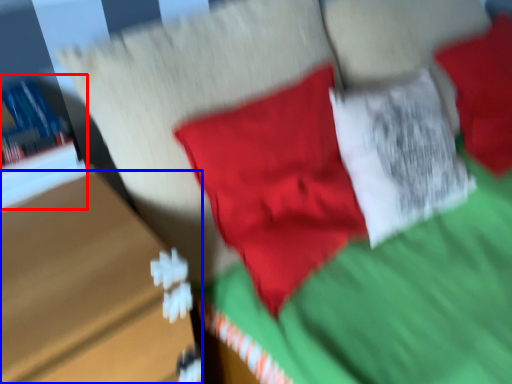
Question: Among these objects, which one is nearest to the camera, book (highlighted by a red box) or table (highlighted by a blue box)?

Choices:
 (A) book
 (B) table

Answer: (B)